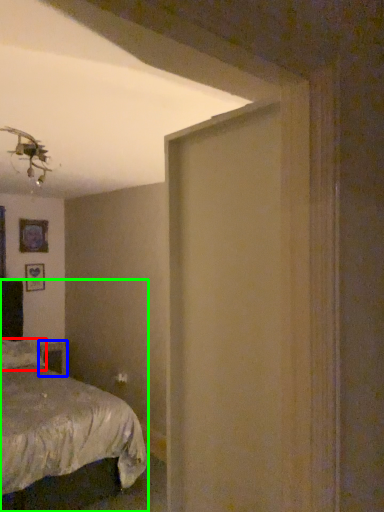
Question: Based on their relative distances, which object is nearer to pillow (highlighted by a red box)? Choose from table (highlighted by a blue box) and bed (highlighted by a green box).

Choices:
 (A) table
 (B) bed

Answer: (B)